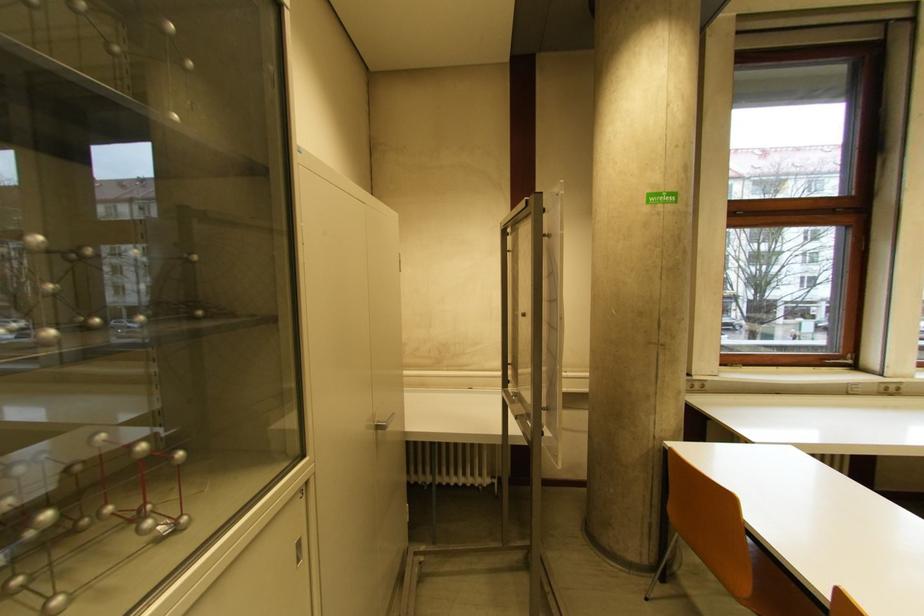
Where is `metal cabinet handle`? metal cabinet handle is located at coordinates (383, 423).